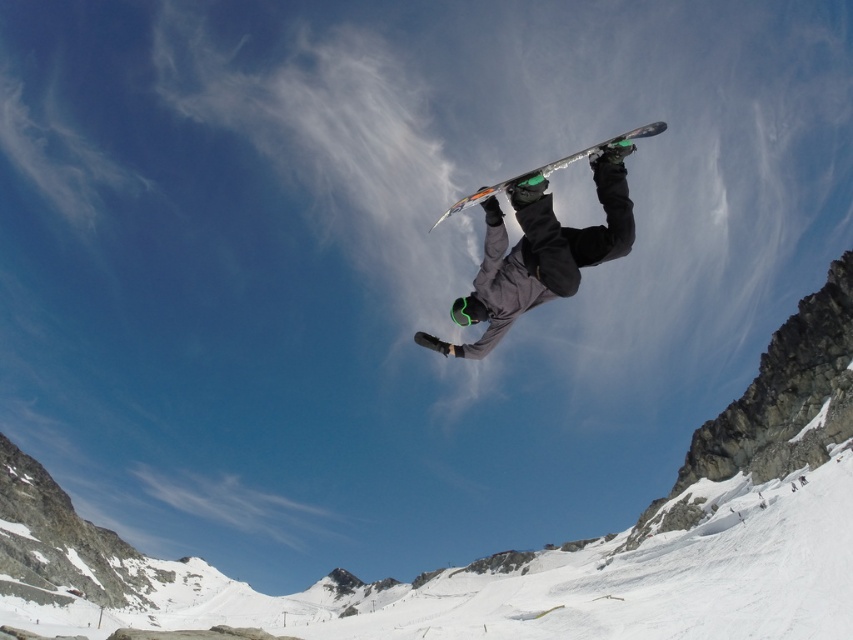
Question: Does matte black snowboarder at center appear on the right side of shiny metallic snowboard at center?

Choices:
 (A) yes
 (B) no

Answer: (B)

Question: Does matte black snowboarder at center appear on the left side of shiny metallic snowboard at center?

Choices:
 (A) yes
 (B) no

Answer: (A)

Question: Can you confirm if matte black snowboarder at center is positioned to the left of shiny metallic snowboard at center?

Choices:
 (A) no
 (B) yes

Answer: (B)

Question: Among these objects, which one is farthest from the camera?

Choices:
 (A) shiny metallic snowboard at center
 (B) matte black snowboarder at center

Answer: (A)